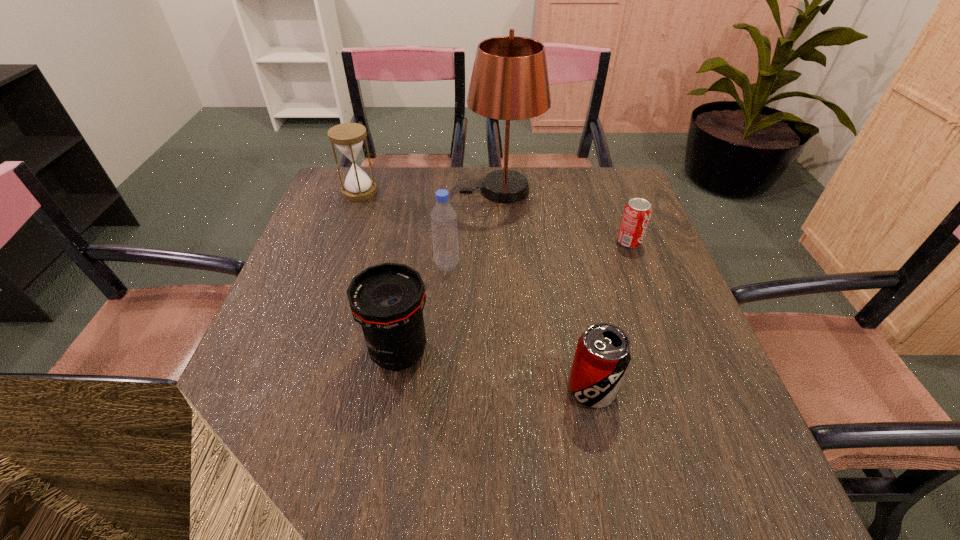
The width and height of the screenshot is (960, 540). What are the coordinates of `object positioned at the far left corner` in the screenshot? It's located at (348, 137).

Locate an element on the screen. This screenshot has width=960, height=540. free region at the far edge of the desktop is located at coordinates (562, 186).

Locate an element on the screen. The image size is (960, 540). free space at the near edge of the desktop is located at coordinates (550, 503).

This screenshot has width=960, height=540. Identify the location of vacant space at the left edge of the desktop. pos(344,225).

This screenshot has height=540, width=960. In the image, there is a desktop. What are the coordinates of `vacant space at the right edge` in the screenshot? It's located at (661, 397).

At what (x,y) coordinates should I click in order to perform the action: click on vacant region between the leftmost object and the lampshade. Please return your answer as a coordinate pair (x, y). Looking at the image, I should click on (430, 191).

Identify the location of vacant area between the tallest object and the rightmost object. (564, 215).

Identify the location of free space that is in between the tallest object and the rightmost object. The image size is (960, 540). (564, 215).

You are a GUI agent. You are given a task and a screenshot of the screen. Output one action in this format:
    pyautogui.click(x=<x>, y=<y>)
    Task: Click on the vacant point located between the leftmost object and the bottle
    This screenshot has width=960, height=540.
    Given the screenshot: What is the action you would take?
    pyautogui.click(x=403, y=228)

I want to click on free space that is in between the leftmost object and the nearer soda can, so click(476, 290).